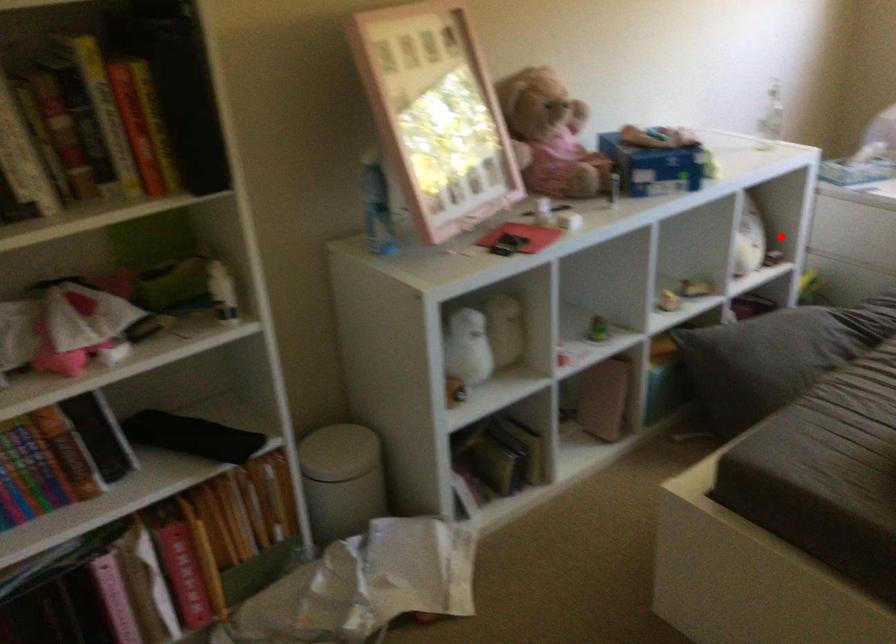
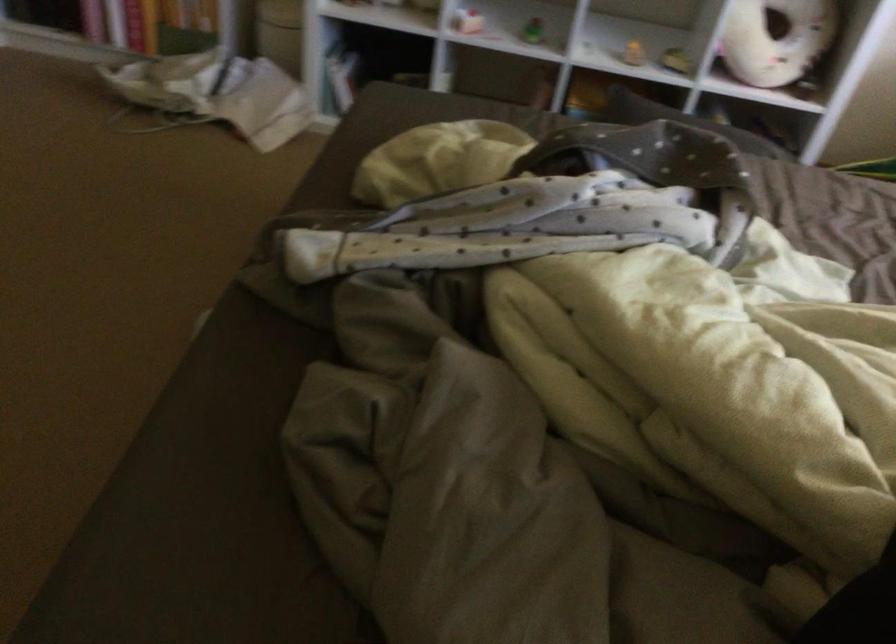
Question: I am providing you with two images of the same scene from different viewpoints. Given a red point in image1, look at the same physical point in image2. Is it:

Choices:
 (A) Closer to the viewpoint
 (B) Farther from the viewpoint

Answer: (A)